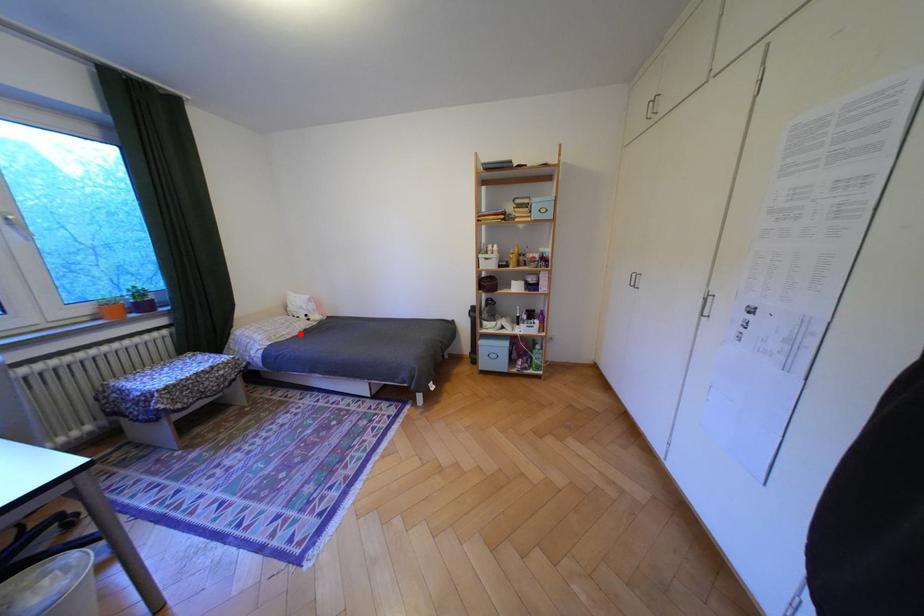
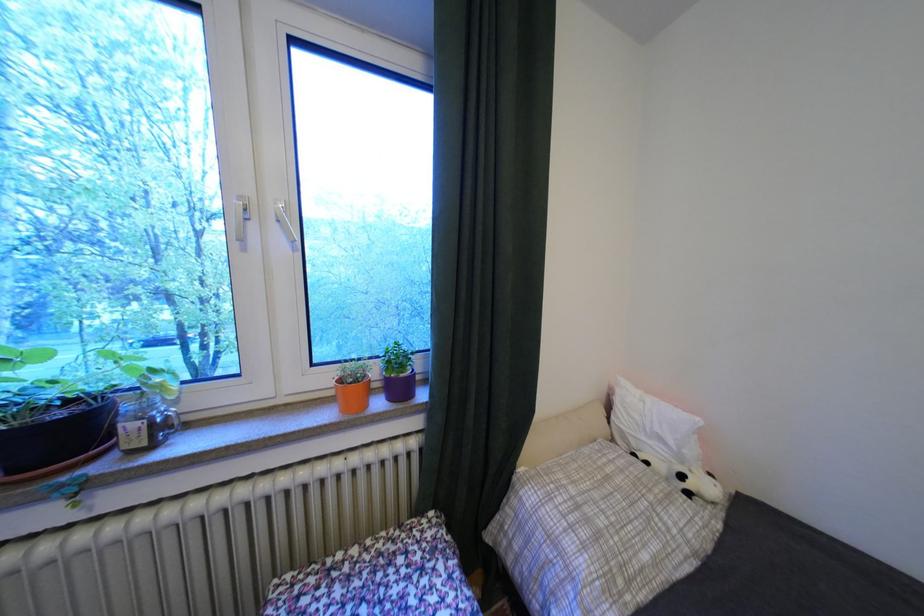
Question: I am providing you with two images of the same scene from different viewpoints. Given a red point in image1, look at the same physical point in image2. Is it:

Choices:
 (A) Closer to the viewpoint
 (B) Farther from the viewpoint

Answer: (B)